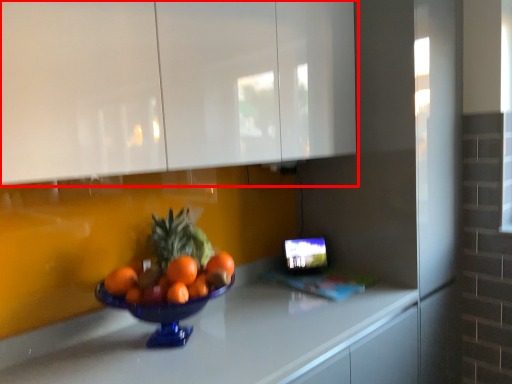
Question: From the image, what is the correct spatial relationship of cabinetry (annotated by the red box) in relation to countertop?

Choices:
 (A) right
 (B) left

Answer: (B)